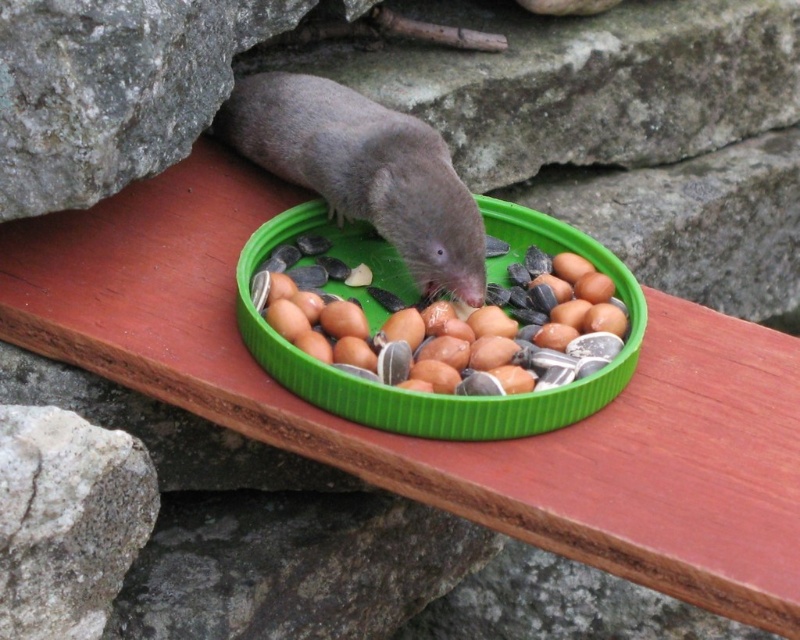
Question: In this image, where is brown matte seeds at center located relative to gray matte/metallic mole at center?

Choices:
 (A) left
 (B) right

Answer: (B)

Question: Considering the relative positions of brown matte seeds at center and gray matte/metallic mole at center in the image provided, where is brown matte seeds at center located with respect to gray matte/metallic mole at center?

Choices:
 (A) right
 (B) left

Answer: (A)

Question: Based on their relative distances, which object is nearer to the gray matte/metallic mole at center?

Choices:
 (A) brown matte seeds at center
 (B) gray rough stone at lower left

Answer: (A)

Question: Which object is positioned closest to the gray rough stone at upper right?

Choices:
 (A) brown matte seeds at center
 (B) gray matte/metallic mole at center

Answer: (A)

Question: Which object is closer to the camera taking this photo?

Choices:
 (A) brown matte seeds at center
 (B) gray rough stone at lower left

Answer: (B)

Question: Does brown matte seeds at center have a greater width compared to gray matte/metallic mole at center?

Choices:
 (A) yes
 (B) no

Answer: (A)